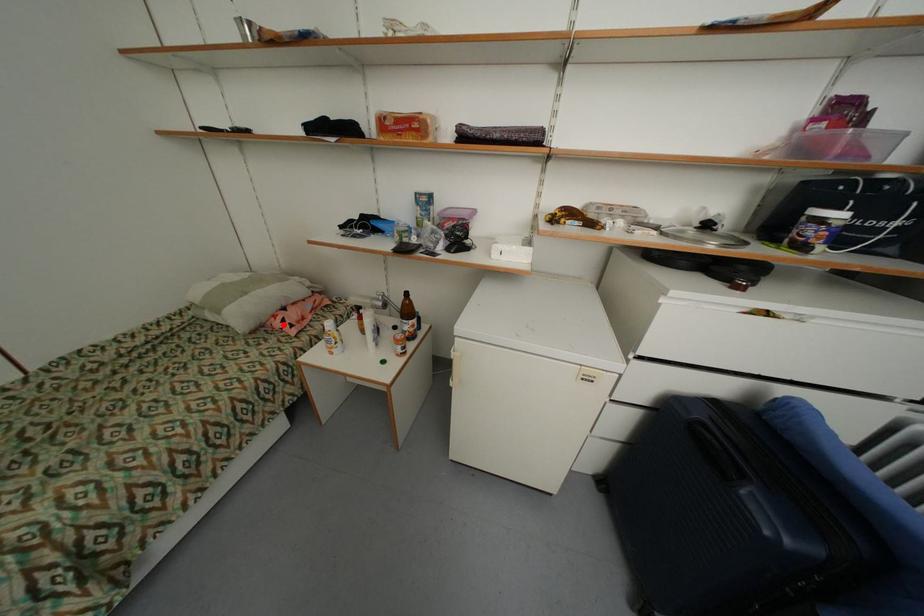
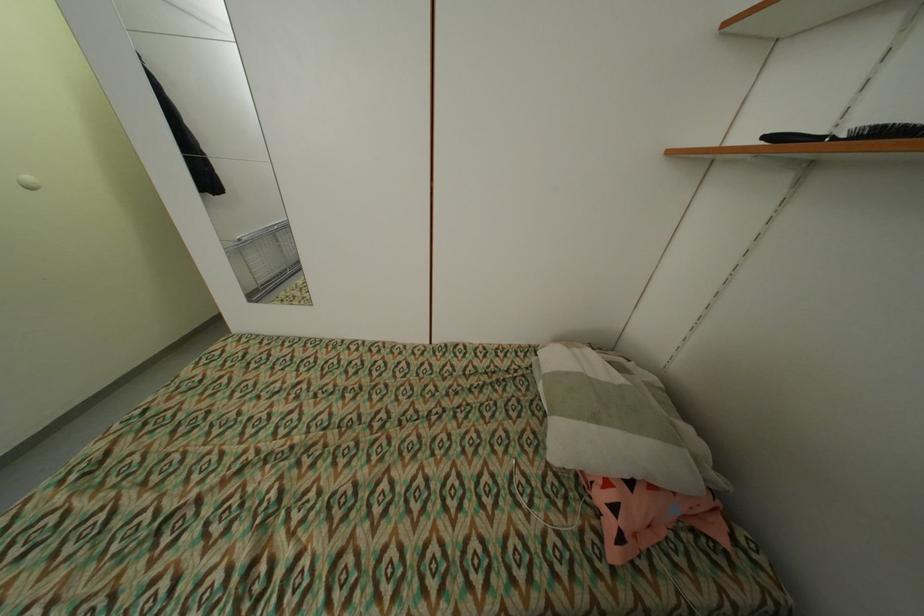
Question: I am providing you with two images of the same scene from different viewpoints. Given a red point in image1, look at the same physical point in image2. Is it:

Choices:
 (A) Closer to the viewpoint
 (B) Farther from the viewpoint

Answer: (B)